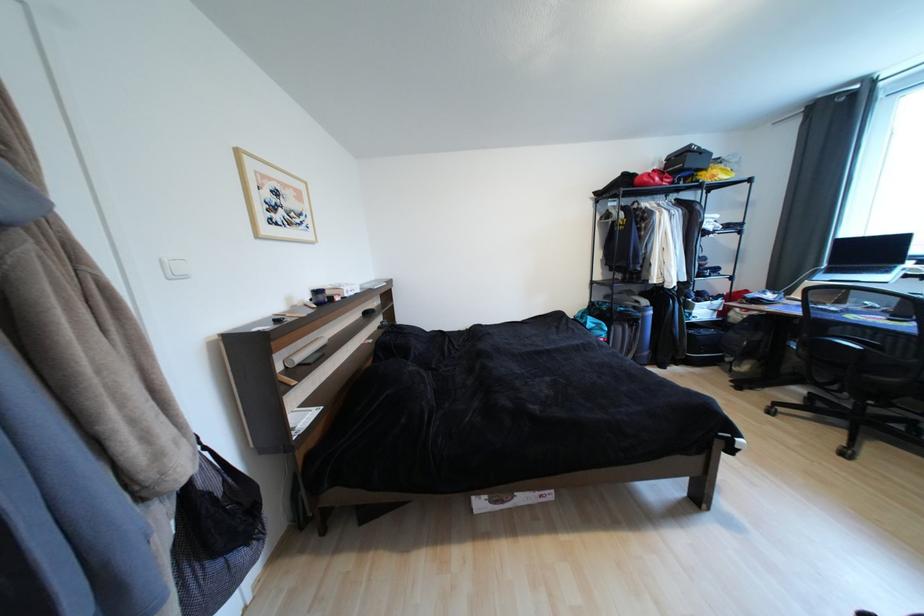
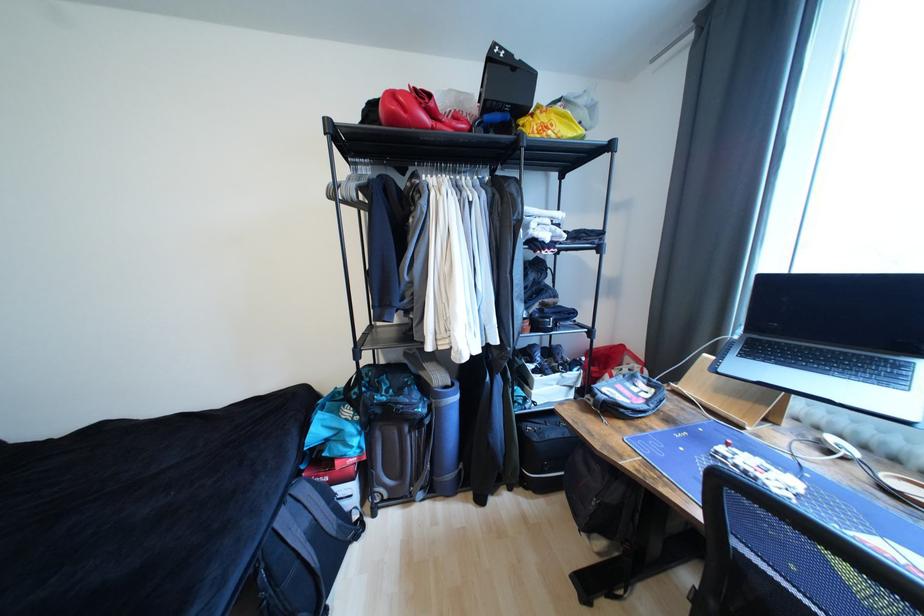
In a continuous first-person perspective shot, in which direction is the camera moving?

The cameraman walked toward right, forward.